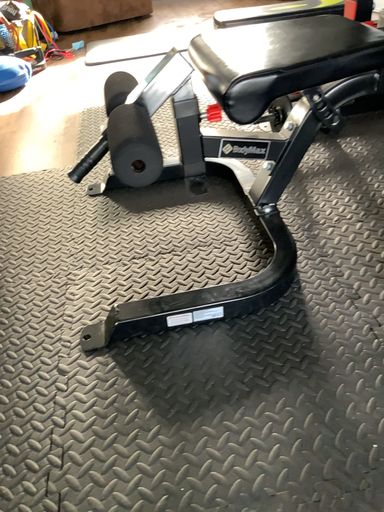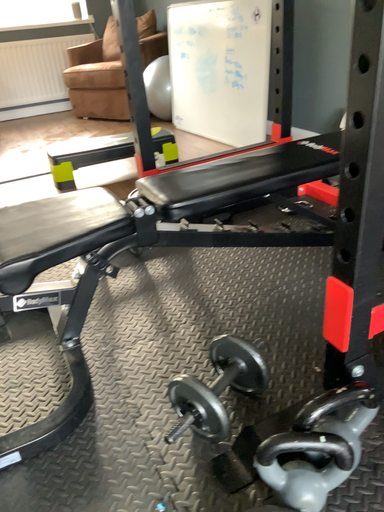
Question: Which way did the camera rotate in the video?

Choices:
 (A) rotated right
 (B) rotated left

Answer: (A)